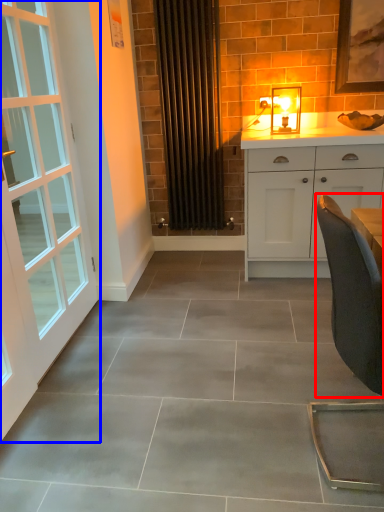
Question: Among these objects, which one is farthest to the camera, chair (highlighted by a red box) or door (highlighted by a blue box)?

Choices:
 (A) chair
 (B) door

Answer: (B)